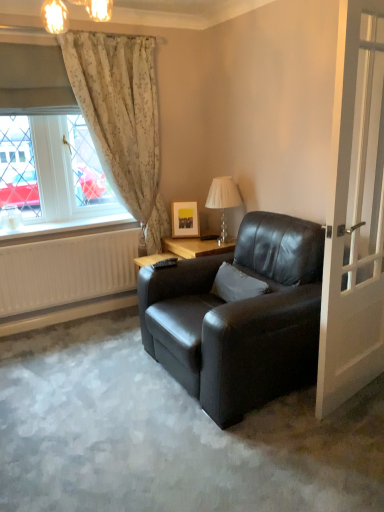
Question: In the image, is white soft pillow at center on the left side or the right side of floral fabric curtain at left?

Choices:
 (A) left
 (B) right

Answer: (B)

Question: Choose the correct answer: Is white soft pillow at center inside floral fabric curtain at left or outside it?

Choices:
 (A) outside
 (B) inside

Answer: (A)

Question: Which is nearer to the translucent glass table lamp at upper center?

Choices:
 (A) white soft pillow at center
 (B) white matte radiator at lower left
 (C) matte black armchair at center
 (D) white floral curtains at upper left
 (E) floral fabric curtain at left

Answer: (A)

Question: Estimate the real-world distances between objects in this image. Which object is farther from the white glossy door at right?

Choices:
 (A) white soft pillow at center
 (B) floral fabric curtain at left
 (C) white matte radiator at lower left
 (D) translucent glass table lamp at upper center
 (E) matte black armchair at center

Answer: (C)